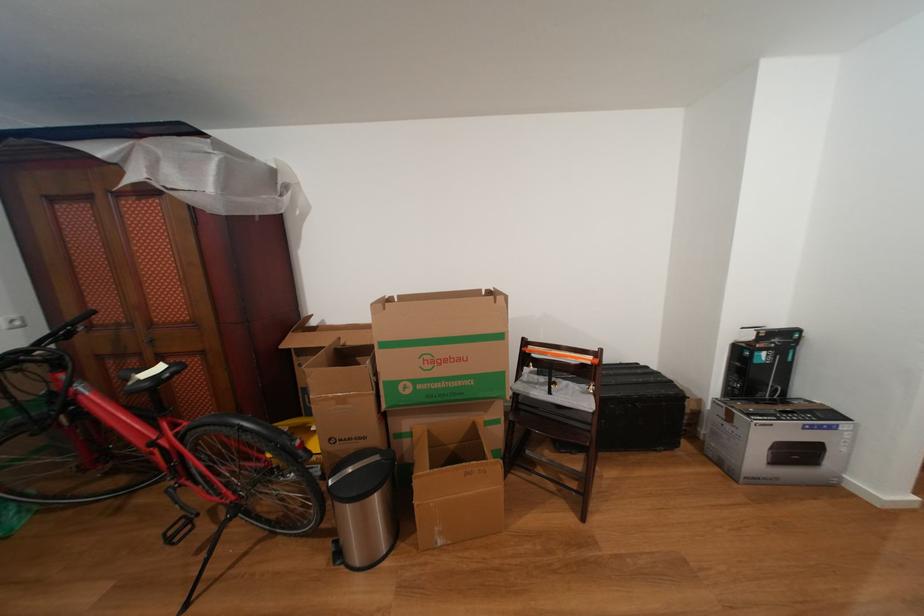
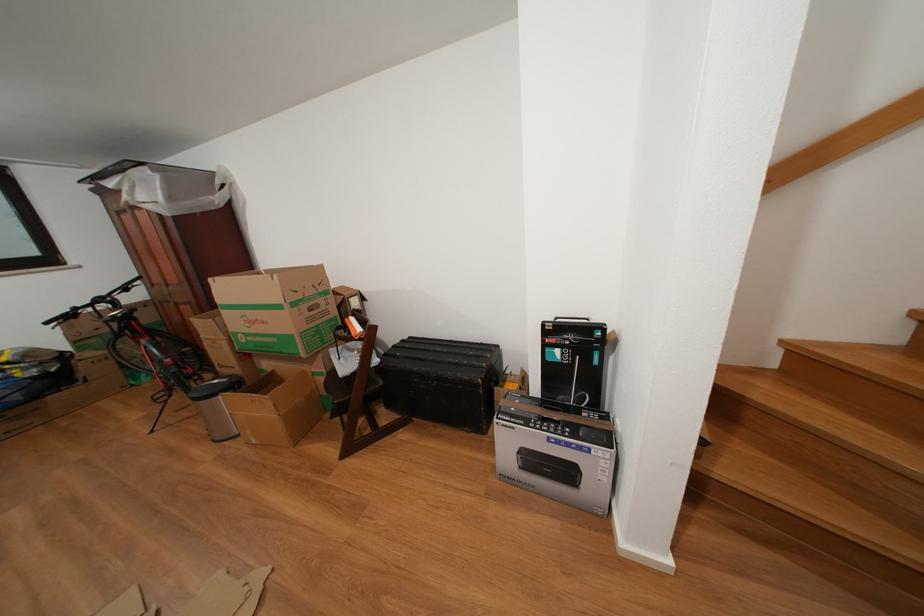
Where in the second image is the point corresponding to point (807, 336) from the first image?

(611, 333)